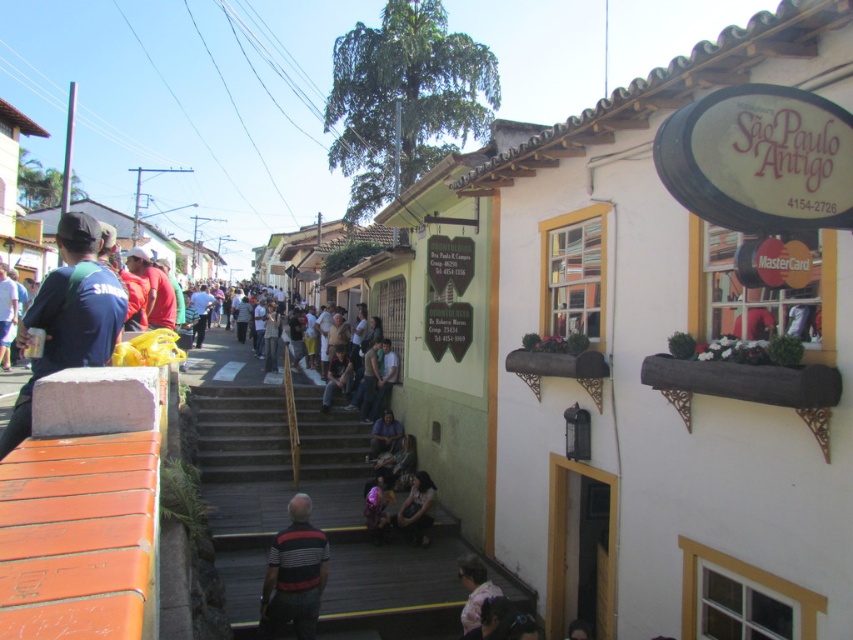
Based on the photo, between dark blue jersey at left and striped cotton shirt at center, which one is positioned lower?

striped cotton shirt at center is lower down.

Is dark blue jersey at left positioned behind striped cotton shirt at center?

No.

Is point (73, 259) farther from camera compared to point (300, 582)?

No, it is not.

Where is `dark blue jersey at left`? The image size is (853, 640). dark blue jersey at left is located at coordinates (68, 316).

Does white concrete stairs at center appear over dark brown leather jacket at center?

Indeed, white concrete stairs at center is positioned over dark brown leather jacket at center.

Is white concrete stairs at center thinner than dark brown leather jacket at center?

No.

This screenshot has height=640, width=853. Find the location of `white concrete stairs at center`. white concrete stairs at center is located at coordinates (230, 362).

Which is behind, point (70, 234) or point (383, 426)?

The point (383, 426) is behind.

Is dark blue jersey at left taller than dark blue jeans at center?

No.

Does point (122, 305) come behind point (378, 445)?

No, it is in front of (378, 445).

Locate an element on the screen. The image size is (853, 640). dark blue jersey at left is located at coordinates (68, 316).